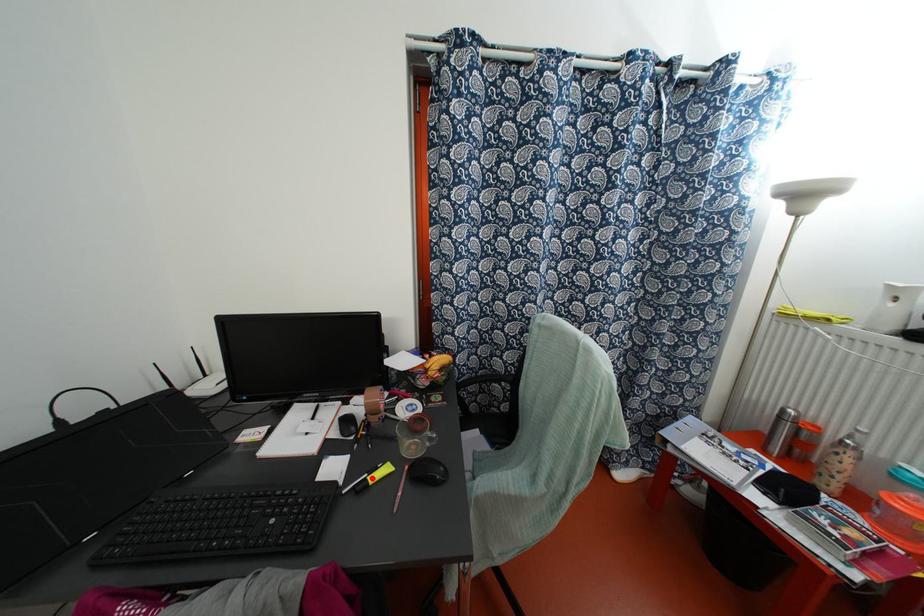
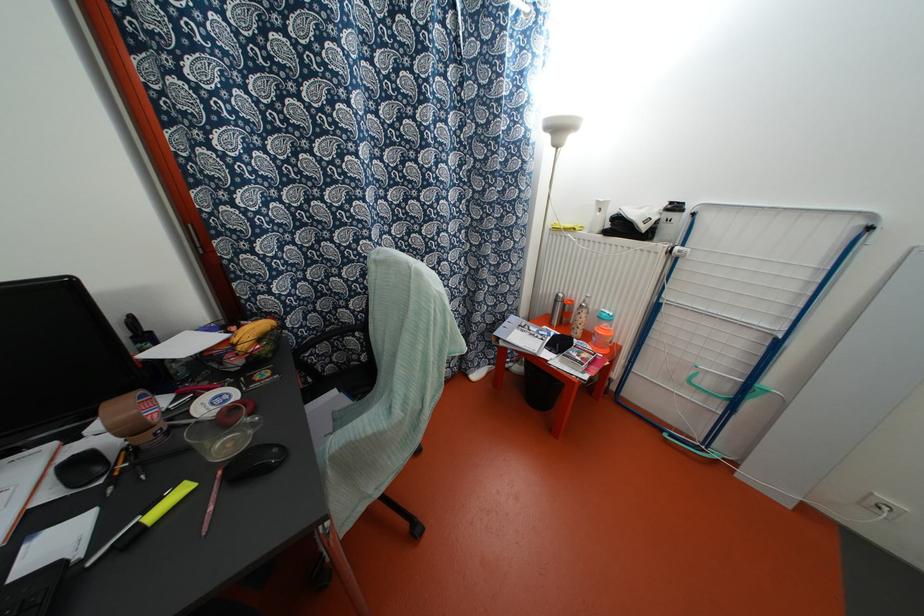
Locate, in the second image, the point that corresponds to the highlighted location in the first image.

(152, 515)